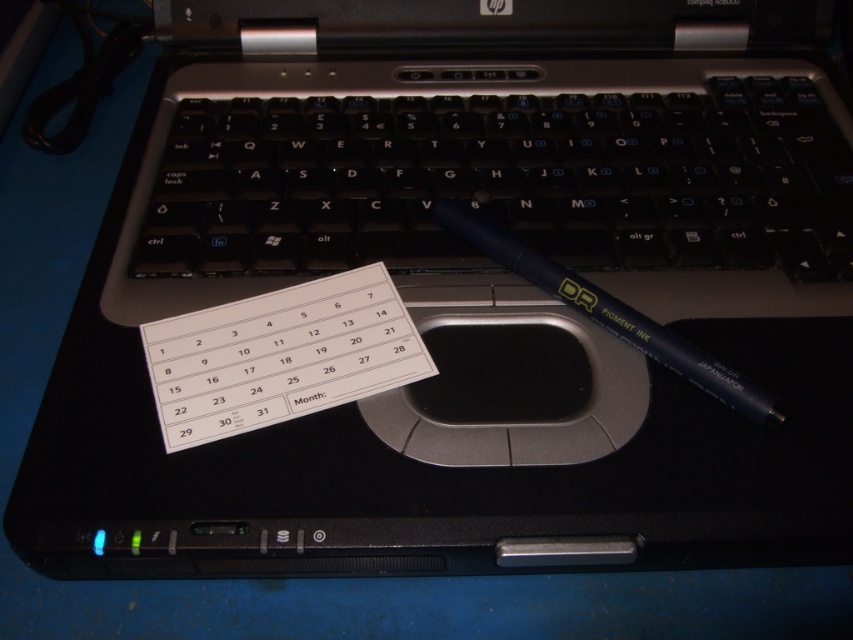
Question: Based on their relative distances, which object is farther from the matte black pen at center?

Choices:
 (A) white paper calendar at center
 (B) black plastic keyboard at center

Answer: (B)

Question: Can you confirm if black plastic keyboard at center is positioned to the right of matte black pen at center?

Choices:
 (A) yes
 (B) no

Answer: (B)

Question: From the image, what is the correct spatial relationship of white paper calendar at center in relation to matte black pen at center?

Choices:
 (A) below
 (B) above

Answer: (A)

Question: Which object appears farthest from the camera in this image?

Choices:
 (A) white paper calendar at center
 (B) matte black pen at center
 (C) black plastic keyboard at center

Answer: (C)

Question: Can you confirm if black plastic keyboard at center is positioned below matte black pen at center?

Choices:
 (A) yes
 (B) no

Answer: (B)

Question: Considering the real-world distances, which object is farthest from the white paper calendar at center?

Choices:
 (A) black plastic keyboard at center
 (B) matte black pen at center

Answer: (A)